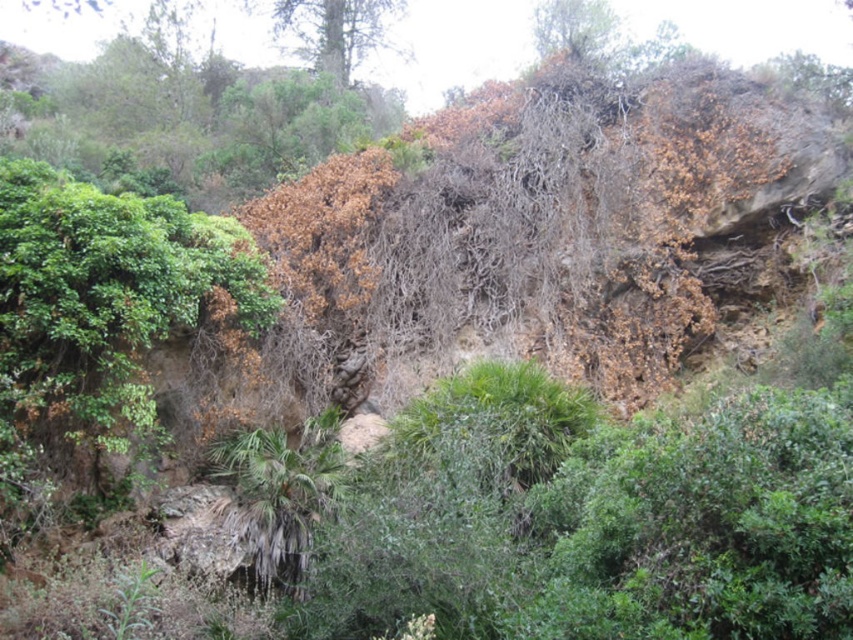
Is point (379, 44) less distant than point (575, 32)?

That is False.

Who is positioned more to the left, green leafy tree at upper center or brown textured tree at upper center?

From the viewer's perspective, green leafy tree at upper center appears more on the left side.

Who is more distant from viewer, (364,22) or (610,40)?

The point (364,22) is behind.

Where is `green leafy tree at upper center`? The height and width of the screenshot is (640, 853). green leafy tree at upper center is located at coordinates (335, 29).